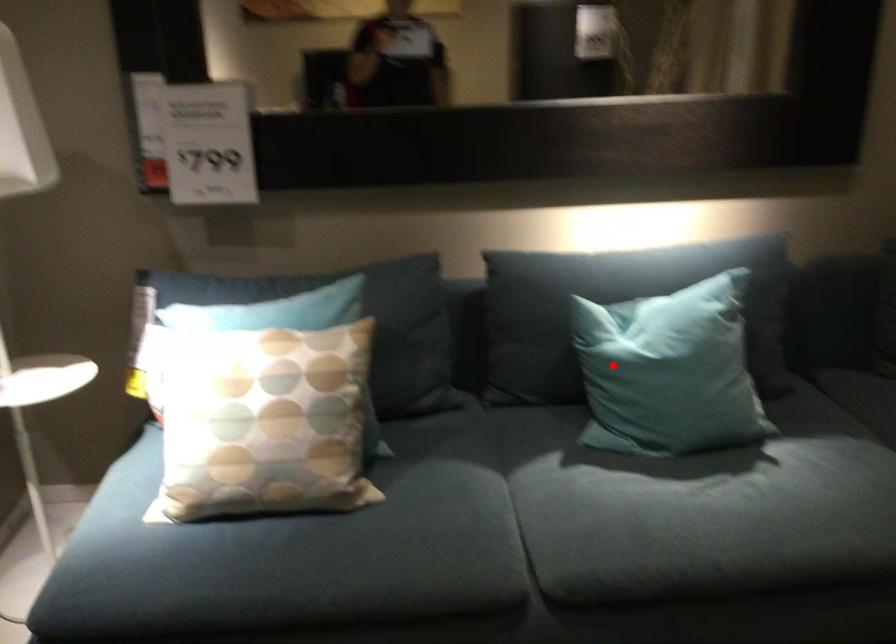
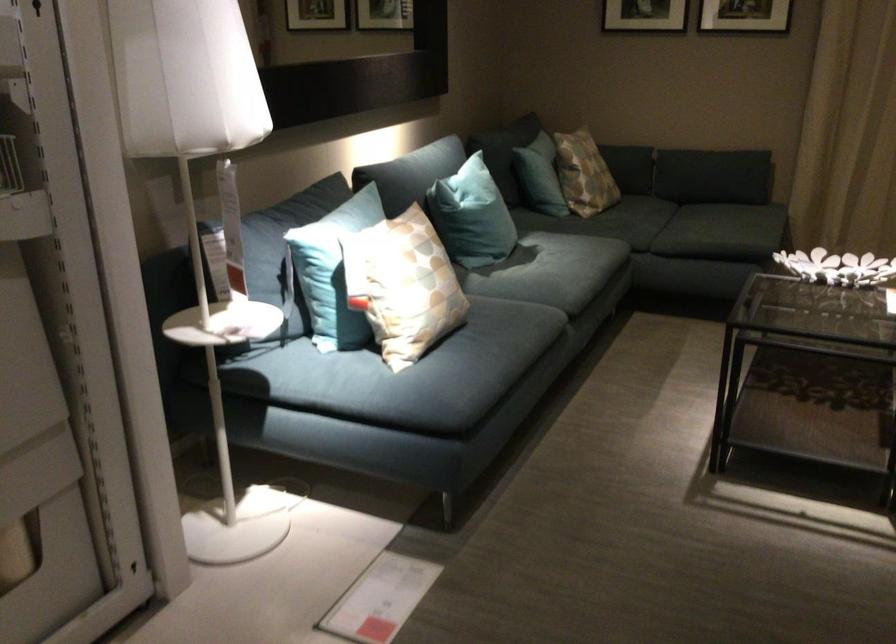
In the second image, find the point that corresponds to the highlighted location in the first image.

(471, 216)